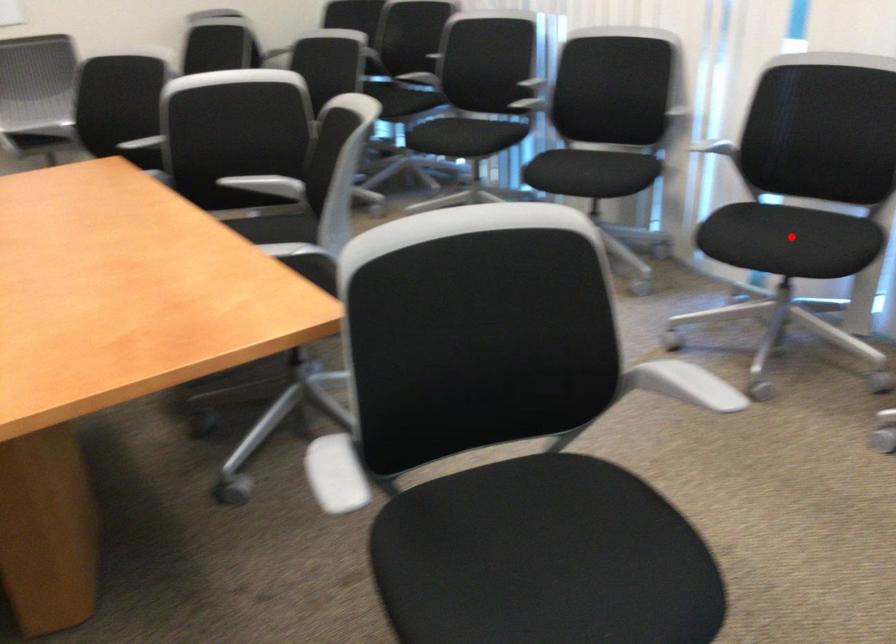
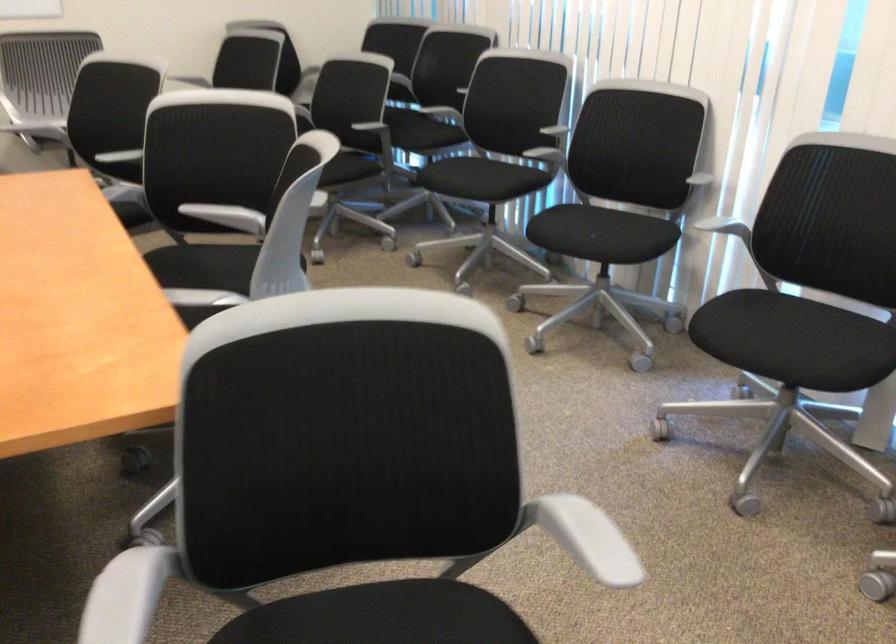
Question: I am providing you with two images of the same scene from different viewpoints. Given a red point in image1, look at the same physical point in image2. Is it:

Choices:
 (A) Closer to the viewpoint
 (B) Farther from the viewpoint

Answer: (A)